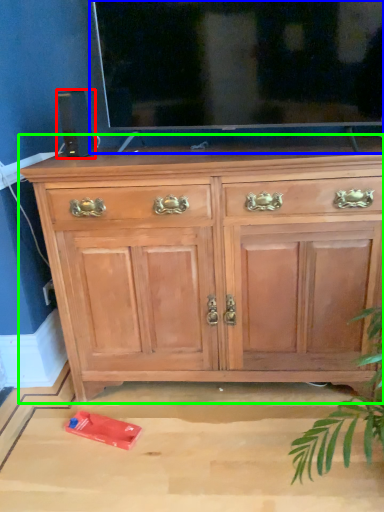
Question: Based on their relative distances, which object is nearer to speaker (highlighted by a red box)? Choose from glass door (highlighted by a blue box) and chest of drawers (highlighted by a green box).

Choices:
 (A) glass door
 (B) chest of drawers

Answer: (A)